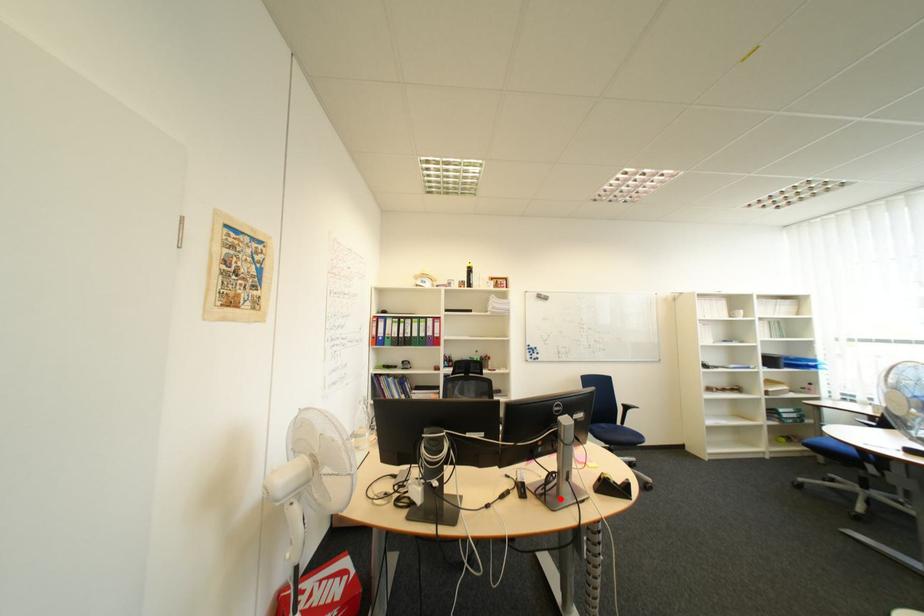
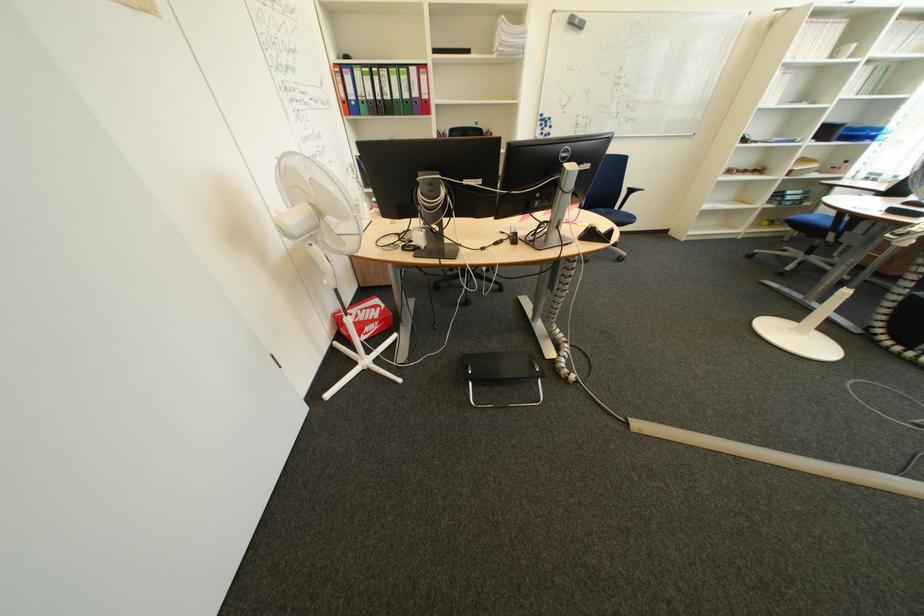
Question: I am providing you with two images of the same scene from different viewpoints. In image1, a red point is highlighted. Considering the same 3D point in image2, which of the following is correct?

Choices:
 (A) It is closer
 (B) It is farther

Answer: (A)